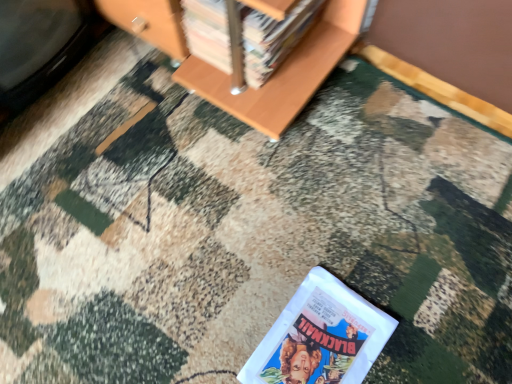
You are a GUI agent. You are given a task and a screenshot of the screen. Output one action in this format:
    pyautogui.click(x=<x>, y=<y>)
    Task: Click on the wooden bookshelf at upper center, the first book when ordered from top to bottom
    This screenshot has height=384, width=512.
    Given the screenshot: What is the action you would take?
    pyautogui.click(x=273, y=39)

What do you see at coordinates (273, 39) in the screenshot?
I see `wooden bookshelf at upper center, the first book when ordered from top to bottom` at bounding box center [273, 39].

In the scene shown: How much space does wooden bookshelf at upper center, positioned as the second book in bottom-to-top order, occupy vertically?

wooden bookshelf at upper center, positioned as the second book in bottom-to-top order, is 8.52 inches tall.

Describe the element at coordinates (320, 337) in the screenshot. I see `white glossy book at lower center, the first book positioned from the bottom` at that location.

The width and height of the screenshot is (512, 384). Identify the location of white glossy book at lower center, the 2th book in the top-to-bottom sequence. (320, 337).

Where is `wooden bookshelf at upper center, positioned as the second book in bottom-to-top order`? wooden bookshelf at upper center, positioned as the second book in bottom-to-top order is located at coordinates (273, 39).

Is wooden bookshelf at upper center, the first book when ordered from top to bottom, to the left of white glossy book at lower center, the 2th book in the top-to-bottom sequence, from the viewer's perspective?

Yes, wooden bookshelf at upper center, the first book when ordered from top to bottom, is to the left of white glossy book at lower center, the 2th book in the top-to-bottom sequence.

Between wooden bookshelf at upper center, positioned as the second book in bottom-to-top order, and white glossy book at lower center, the first book positioned from the bottom, which one is positioned in front?

white glossy book at lower center, the first book positioned from the bottom, is in front.

Is point (193, 39) in front of point (331, 302)?

No, (193, 39) is further to viewer.

From the image's perspective, which is above, wooden bookshelf at upper center, positioned as the second book in bottom-to-top order, or white glossy book at lower center, the 2th book in the top-to-bottom sequence?

wooden bookshelf at upper center, positioned as the second book in bottom-to-top order, from the image's perspective.

From a real-world perspective, is wooden bookshelf at upper center, positioned as the second book in bottom-to-top order, located beneath white glossy book at lower center, the 2th book in the top-to-bottom sequence?

Incorrect, from a real-world perspective, wooden bookshelf at upper center, positioned as the second book in bottom-to-top order, is higher than white glossy book at lower center, the 2th book in the top-to-bottom sequence.

Which of these two, wooden bookshelf at upper center, the first book when ordered from top to bottom, or white glossy book at lower center, the first book positioned from the bottom, is thinner?

white glossy book at lower center, the first book positioned from the bottom.

Consider the image. Does wooden bookshelf at upper center, positioned as the second book in bottom-to-top order, have a greater height compared to white glossy book at lower center, the first book positioned from the bottom?

Yes, wooden bookshelf at upper center, positioned as the second book in bottom-to-top order, is taller than white glossy book at lower center, the first book positioned from the bottom.

In terms of size, does wooden bookshelf at upper center, positioned as the second book in bottom-to-top order, appear bigger or smaller than white glossy book at lower center, the 2th book in the top-to-bottom sequence?

Considering their sizes, wooden bookshelf at upper center, positioned as the second book in bottom-to-top order, takes up more space than white glossy book at lower center, the 2th book in the top-to-bottom sequence.

Is wooden bookshelf at upper center, positioned as the second book in bottom-to-top order, spatially inside white glossy book at lower center, the 2th book in the top-to-bottom sequence, or outside of it?

wooden bookshelf at upper center, positioned as the second book in bottom-to-top order, is not enclosed by white glossy book at lower center, the 2th book in the top-to-bottom sequence.

Is wooden bookshelf at upper center, positioned as the second book in bottom-to-top order, far away from white glossy book at lower center, the 2th book in the top-to-bottom sequence?

No, there isn't a large distance between wooden bookshelf at upper center, positioned as the second book in bottom-to-top order, and white glossy book at lower center, the 2th book in the top-to-bottom sequence.

Does wooden bookshelf at upper center, positioned as the second book in bottom-to-top order, turn towards white glossy book at lower center, the 2th book in the top-to-bottom sequence?

No, wooden bookshelf at upper center, positioned as the second book in bottom-to-top order, does not turn towards white glossy book at lower center, the 2th book in the top-to-bottom sequence.

The height and width of the screenshot is (384, 512). In order to click on book on the right of wooden bookshelf at upper center, the first book when ordered from top to bottom in this screenshot , I will do `click(320, 337)`.

Is white glossy book at lower center, the 2th book in the top-to-bottom sequence, to the left or to the right of wooden bookshelf at upper center, the first book when ordered from top to bottom, in the image?

Based on their positions, white glossy book at lower center, the 2th book in the top-to-bottom sequence, is located to the right of wooden bookshelf at upper center, the first book when ordered from top to bottom.

Which object is further away from the camera taking this photo, white glossy book at lower center, the first book positioned from the bottom, or wooden bookshelf at upper center, positioned as the second book in bottom-to-top order?

wooden bookshelf at upper center, positioned as the second book in bottom-to-top order, is more distant.

Consider the image. Which is closer to the camera, (296, 356) or (194, 45)?

Clearly, point (296, 356) is closer to the camera than point (194, 45).

From the image's perspective, which object appears higher, white glossy book at lower center, the first book positioned from the bottom, or wooden bookshelf at upper center, the first book when ordered from top to bottom?

wooden bookshelf at upper center, the first book when ordered from top to bottom.

From a real-world perspective, is white glossy book at lower center, the 2th book in the top-to-bottom sequence, on top of wooden bookshelf at upper center, positioned as the second book in bottom-to-top order?

No, from a real-world perspective, white glossy book at lower center, the 2th book in the top-to-bottom sequence, is not on top of wooden bookshelf at upper center, positioned as the second book in bottom-to-top order.

Between white glossy book at lower center, the 2th book in the top-to-bottom sequence, and wooden bookshelf at upper center, positioned as the second book in bottom-to-top order, which one has smaller width?

white glossy book at lower center, the 2th book in the top-to-bottom sequence, is thinner.

Can you confirm if white glossy book at lower center, the first book positioned from the bottom, is taller than wooden bookshelf at upper center, positioned as the second book in bottom-to-top order?

In fact, white glossy book at lower center, the first book positioned from the bottom, may be shorter than wooden bookshelf at upper center, positioned as the second book in bottom-to-top order.

Can you confirm if white glossy book at lower center, the 2th book in the top-to-bottom sequence, is bigger than wooden bookshelf at upper center, the first book when ordered from top to bottom?

No.

Is wooden bookshelf at upper center, the first book when ordered from top to bottom, completely or partially inside white glossy book at lower center, the first book positioned from the bottom?

Actually, wooden bookshelf at upper center, the first book when ordered from top to bottom, is outside white glossy book at lower center, the first book positioned from the bottom.

Would you say white glossy book at lower center, the first book positioned from the bottom, is a long distance from wooden bookshelf at upper center, the first book when ordered from top to bottom?

No, white glossy book at lower center, the first book positioned from the bottom, is in close proximity to wooden bookshelf at upper center, the first book when ordered from top to bottom.

Is white glossy book at lower center, the 2th book in the top-to-bottom sequence, aimed at wooden bookshelf at upper center, positioned as the second book in bottom-to-top order?

No, white glossy book at lower center, the 2th book in the top-to-bottom sequence, is not oriented towards wooden bookshelf at upper center, positioned as the second book in bottom-to-top order.

How distant is white glossy book at lower center, the first book positioned from the bottom, from wooden bookshelf at upper center, positioned as the second book in bottom-to-top order?

white glossy book at lower center, the first book positioned from the bottom, and wooden bookshelf at upper center, positioned as the second book in bottom-to-top order, are 23.28 inches apart.

Image resolution: width=512 pixels, height=384 pixels. I want to click on book on the right of wooden bookshelf at upper center, the first book when ordered from top to bottom, so click(320, 337).

Where is `book in front of the wooden bookshelf at upper center, the first book when ordered from top to bottom`? The height and width of the screenshot is (384, 512). book in front of the wooden bookshelf at upper center, the first book when ordered from top to bottom is located at coordinates (320, 337).

Where is `book on the right of wooden bookshelf at upper center, the first book when ordered from top to bottom`? book on the right of wooden bookshelf at upper center, the first book when ordered from top to bottom is located at coordinates (320, 337).